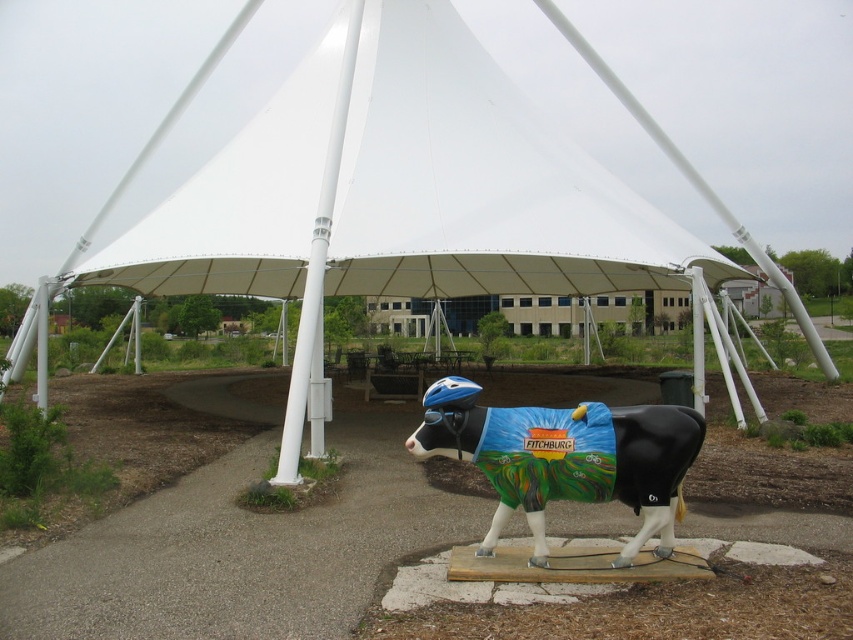
You are standing in the outdoor area and want to walk from the white fabric tent at center to the painted fiberglass cow at center. Which direction should you move in relative to the tent?

You should move backward away from the white fabric tent at center because the painted fiberglass cow at center is behind the tent, as the tent is closer to you than the cow.

You are planning to set up a small table for refreshments under the white fabric tent at center. However, you also need to consider the painted fiberglass cow at center. Is there enough vertical space between them for the table to be placed comfortably?

The white fabric tent at center is located above the painted fiberglass cow at center, so there is sufficient vertical space to place a table between them comfortably.

You are planning to set up a small booth for a community event. The booth requires a space of 30 feet away from the white fabric tent at center to ensure visibility. Given that the painted fiberglass cow at center is already placed, can you position your booth near it while meeting the distance requirement?

The distance between the white fabric tent at center and the painted fiberglass cow at center is 44.54 feet. Since your booth needs to be at least 30 feet away from the tent, positioning it near the cow would satisfy this requirement as 44.54 feet is greater than 30 feet.